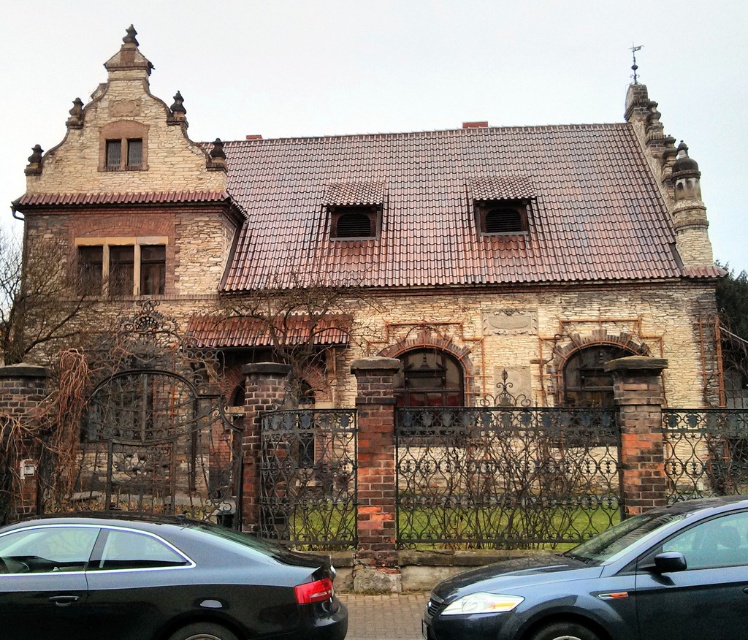
Question: Can you confirm if shiny black sedan at lower left is smaller than metallic blue sedan at center?

Choices:
 (A) no
 (B) yes

Answer: (B)

Question: Does shiny black sedan at lower left come behind metallic blue sedan at center?

Choices:
 (A) no
 (B) yes

Answer: (A)

Question: Is shiny black sedan at lower left bigger than metallic blue sedan at center?

Choices:
 (A) no
 (B) yes

Answer: (A)